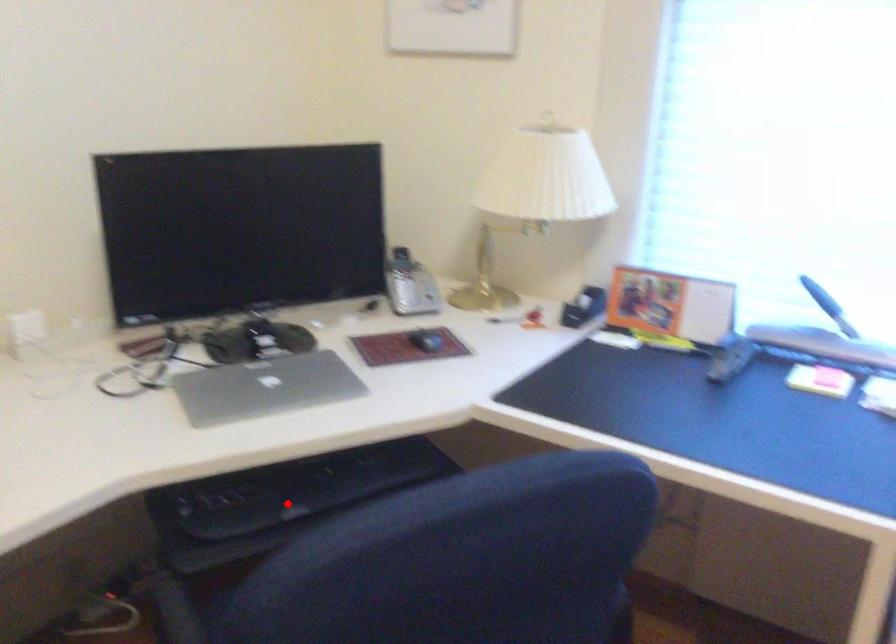
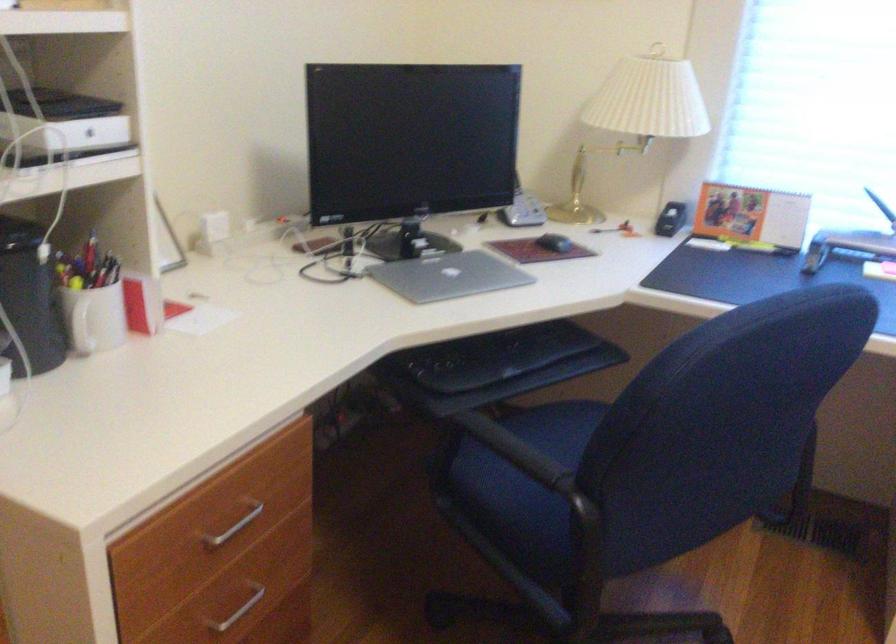
Where in the second image is the point corresponding to the highlighted location from the first image?

(494, 366)